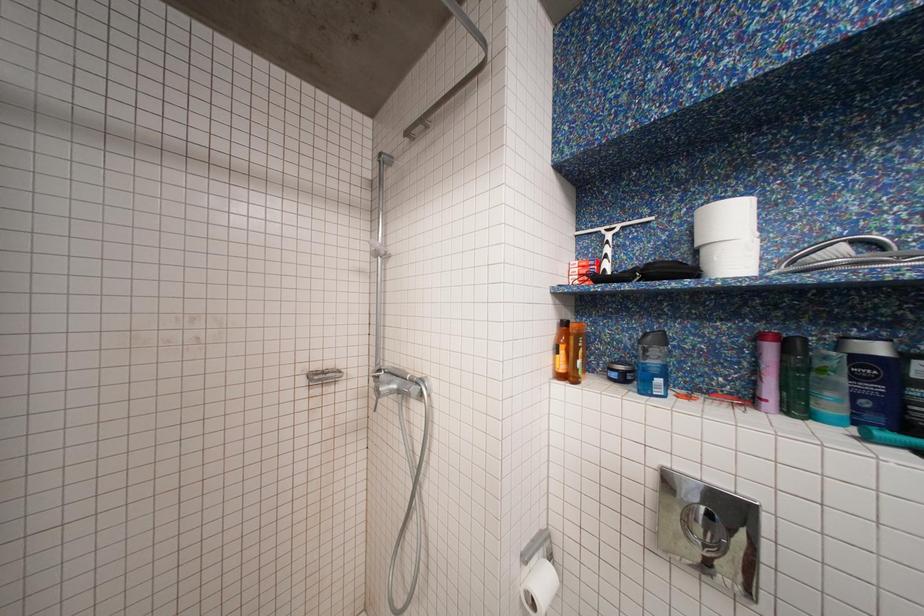
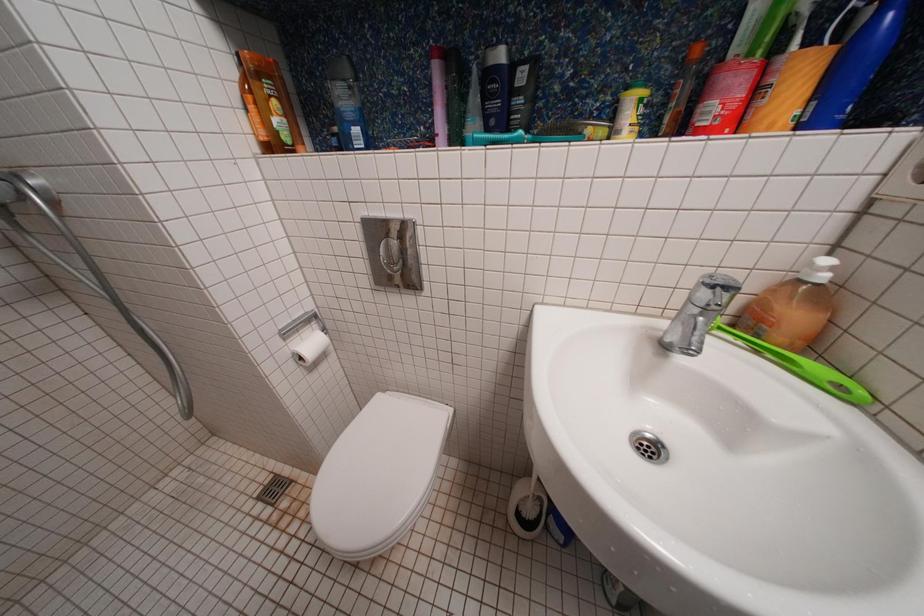
How did the camera likely rotate?

The camera rotated toward right-down.